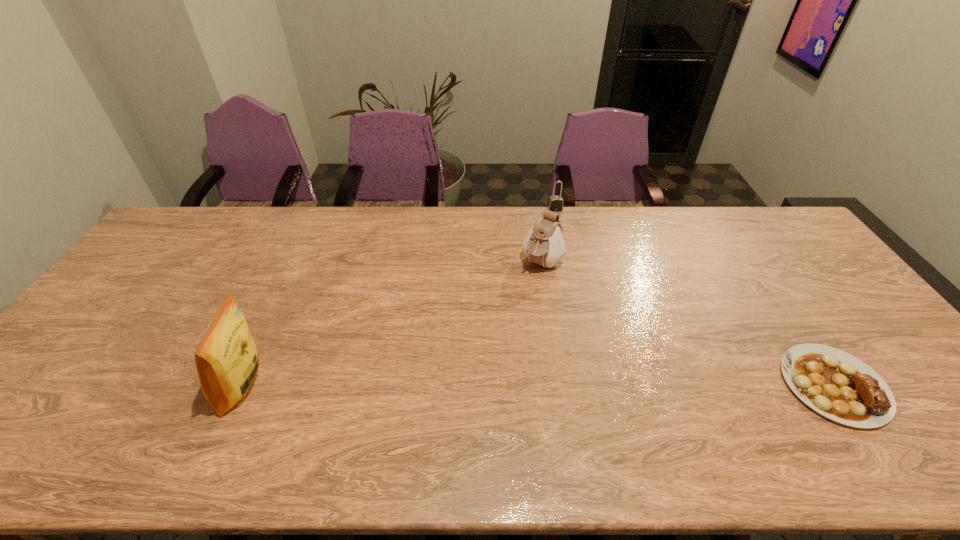
The width and height of the screenshot is (960, 540). In order to click on steak that is positioned at the near edge in this screenshot , I will do `click(837, 385)`.

Where is `object present at the right edge`? object present at the right edge is located at coordinates (837, 385).

Image resolution: width=960 pixels, height=540 pixels. In order to click on object positioned at the near right corner in this screenshot , I will do `click(837, 385)`.

Find the location of a particular element. This screenshot has width=960, height=540. blank space at the far edge of the desktop is located at coordinates (444, 222).

You are a GUI agent. You are given a task and a screenshot of the screen. Output one action in this format:
    pyautogui.click(x=<x>, y=<y>)
    Task: Click on the vacant space at the near edge
    This screenshot has width=960, height=540.
    Given the screenshot: What is the action you would take?
    pyautogui.click(x=299, y=418)

I want to click on vacant point at the left edge, so click(161, 280).

Image resolution: width=960 pixels, height=540 pixels. In the image, there is a desktop. Identify the location of vacant space at the right edge. (847, 310).

I want to click on free spot at the far right corner of the desktop, so click(x=751, y=229).

The height and width of the screenshot is (540, 960). I want to click on blank region between the tallest object and the third shortest object, so click(393, 325).

The height and width of the screenshot is (540, 960). In order to click on free spot between the padlock and the rightmost object in this screenshot , I will do `click(694, 297)`.